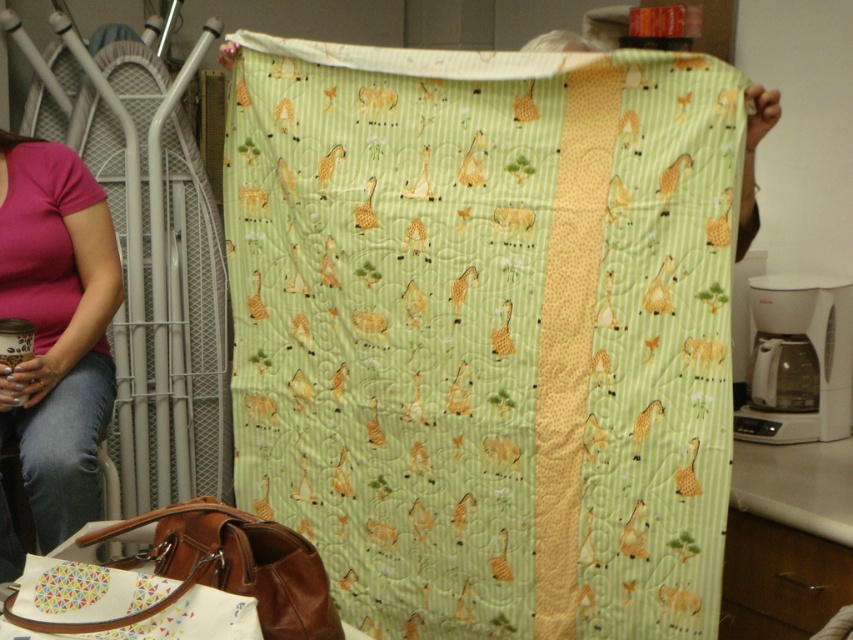
Question: Is pink fabric shirt at left further to the viewer compared to brown leather bag at lower left?

Choices:
 (A) no
 (B) yes

Answer: (B)

Question: Does green quilted fabric at center appear on the left side of brown leather bag at lower left?

Choices:
 (A) yes
 (B) no

Answer: (B)

Question: Which object is positioned closest to the brown leather bag at lower left?

Choices:
 (A) pink fabric shirt at left
 (B) green quilted fabric at center

Answer: (A)

Question: Is the position of green quilted fabric at center less distant than that of pink fabric shirt at left?

Choices:
 (A) yes
 (B) no

Answer: (A)

Question: Which is farther from the pink fabric shirt at left?

Choices:
 (A) brown leather bag at lower left
 (B) green quilted fabric at center

Answer: (A)

Question: Which object appears farthest from the camera in this image?

Choices:
 (A) brown leather bag at lower left
 (B) green quilted fabric at center

Answer: (B)